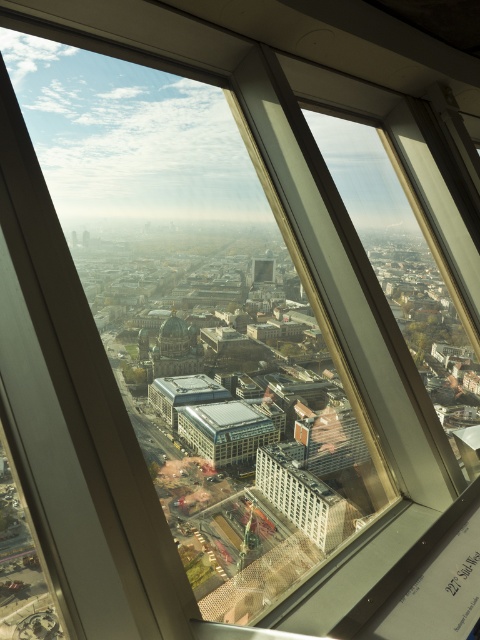
Who is taller, white concrete building at center or matte glass building at center?

With more height is white concrete building at center.

Is white concrete building at center thinner than matte glass building at center?

Yes, white concrete building at center is thinner than matte glass building at center.

Is point (282, 467) positioned before point (243, 436)?

Yes.

The image size is (480, 640). I want to click on white concrete building at center, so click(x=300, y=493).